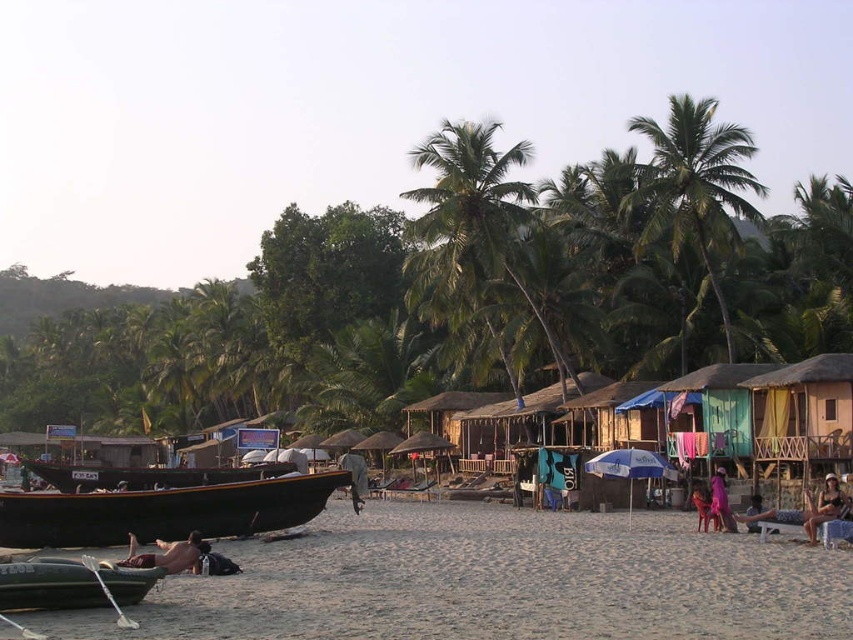
Is green leafy palm tree at upper right to the left of skinny man at lower left from the viewer's perspective?

Incorrect, green leafy palm tree at upper right is not on the left side of skinny man at lower left.

Who is higher up, green leafy palm tree at upper right or skinny man at lower left?

Positioned higher is green leafy palm tree at upper right.

Image resolution: width=853 pixels, height=640 pixels. Describe the element at coordinates (695, 186) in the screenshot. I see `green leafy palm tree at upper right` at that location.

In order to click on green leafy palm tree at upper right in this screenshot , I will do `click(695, 186)`.

Who is taller, skinny man at lower left or purple fabric at center?

With more height is skinny man at lower left.

Is skinny man at lower left to the right of purple fabric at center from the viewer's perspective?

In fact, skinny man at lower left is to the left of purple fabric at center.

Image resolution: width=853 pixels, height=640 pixels. What are the coordinates of `skinny man at lower left` in the screenshot? It's located at (166, 554).

You are a GUI agent. You are given a task and a screenshot of the screen. Output one action in this format:
    pyautogui.click(x=<x>, y=<y>)
    Task: Click on the skinny man at lower left
    
    Given the screenshot: What is the action you would take?
    pyautogui.click(x=166, y=554)

From the picture: Who is lower down, green rubber boat at lower left or beige fabric chair at lower right?

beige fabric chair at lower right

Which of these two, green rubber boat at lower left or beige fabric chair at lower right, stands shorter?

green rubber boat at lower left

Identify the location of green rubber boat at lower left. (70, 584).